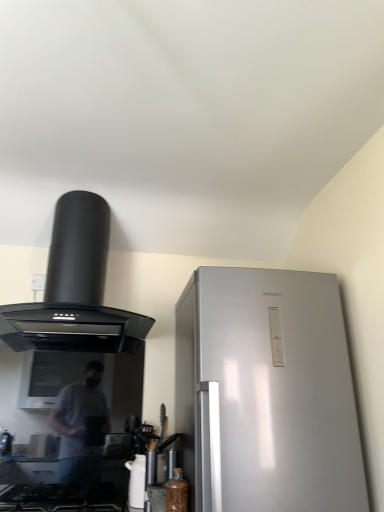
This screenshot has height=512, width=384. In order to click on free location above black matte range hood at upper left (from a real-world perspective) in this screenshot , I will do `click(90, 185)`.